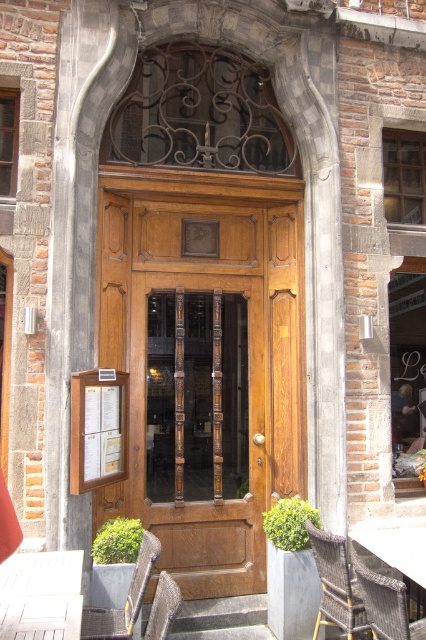
You are a delivery person trying to place a large package that is 22 inches wide between the wooden table at lower left and the metallic woven chair at lower center. Can the package fit in the space between them?

The wooden table at lower left and the metallic woven chair at lower center are 21.56 inches apart. Since the package is 22 inches wide, it is slightly wider than the available space. The package cannot fit between them.

You are sitting on the rattan chair at lower right and want to place a book on the wooden table at lower left. Can you reach the table from your current position?

The rattan chair at lower right is positioned under the wooden table at lower left, so yes, you can easily reach the wooden table at lower left from the rattan chair at lower right.